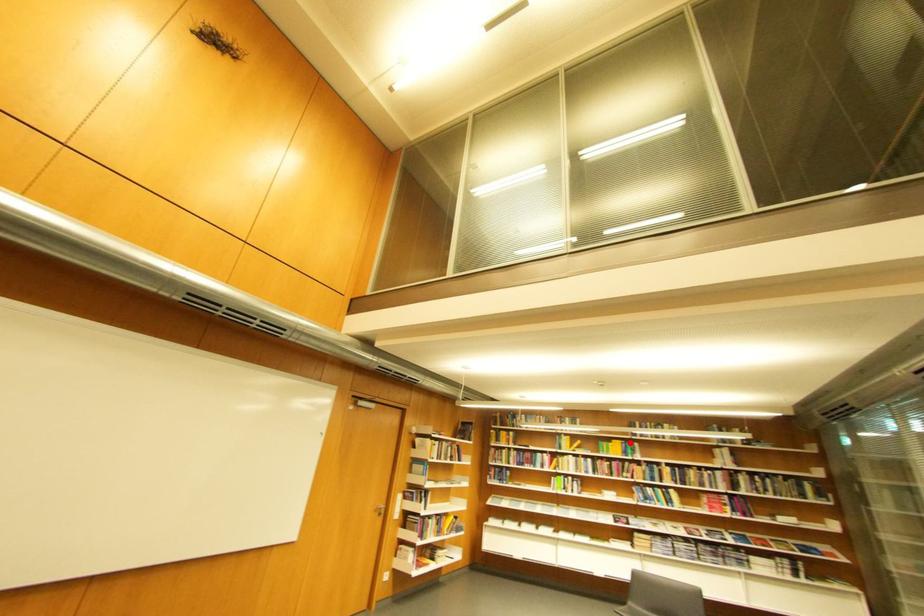
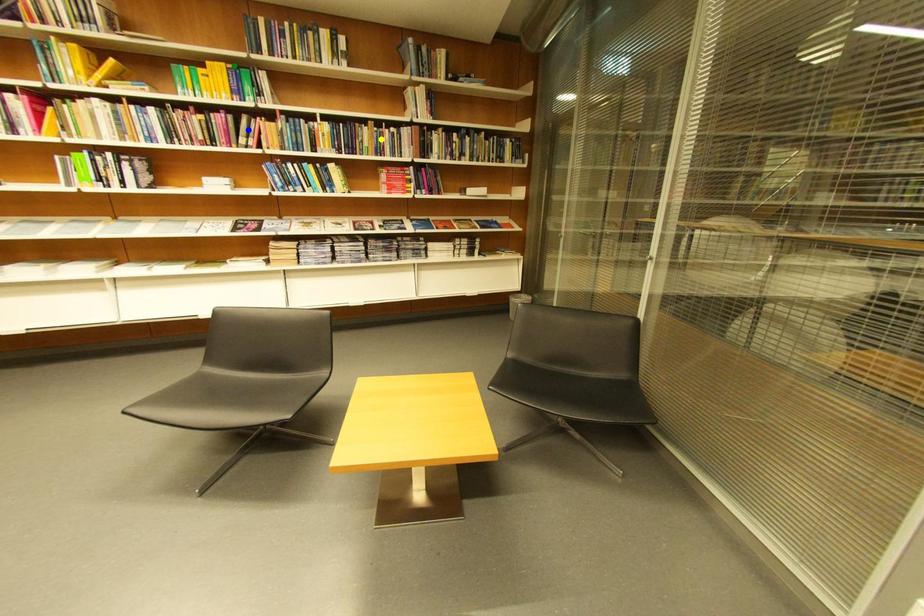
Question: I am providing you with two images of the same scene from different viewpoints. A red point is marked on the first image. You are given multiple points on the second image. In image 2, which mark is for the same physical point as the one in image 1?

Choices:
 (A) green point
 (B) yellow point
 (C) blue point

Answer: (A)